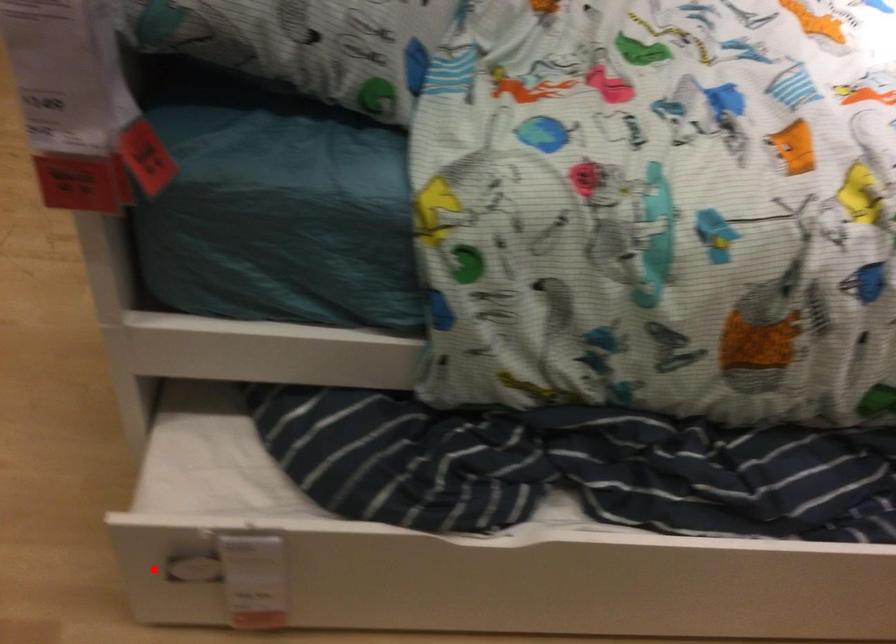
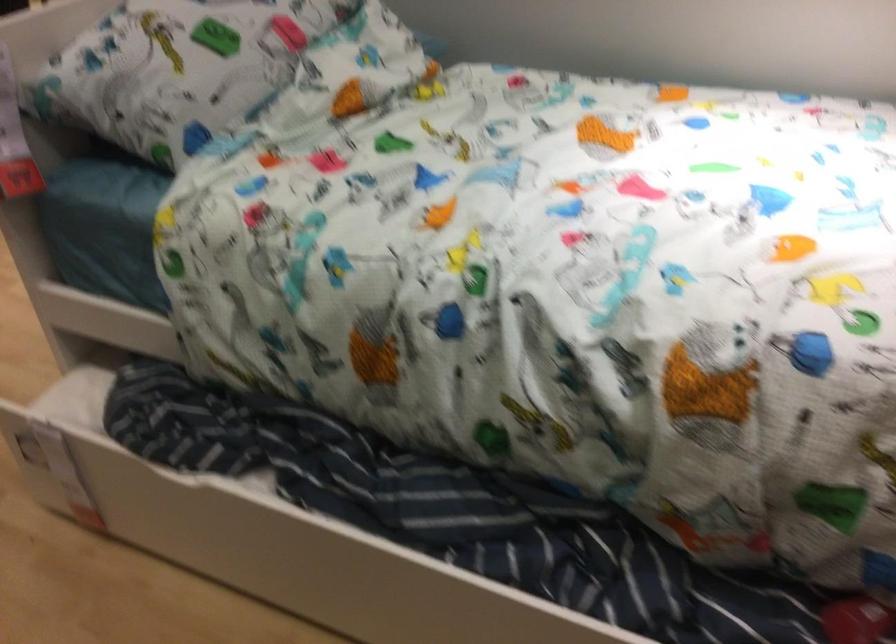
Question: I am providing you with two images of the same scene from different viewpoints. Given a red point in image1, look at the same physical point in image2. Is it:

Choices:
 (A) Closer to the viewpoint
 (B) Farther from the viewpoint

Answer: (B)